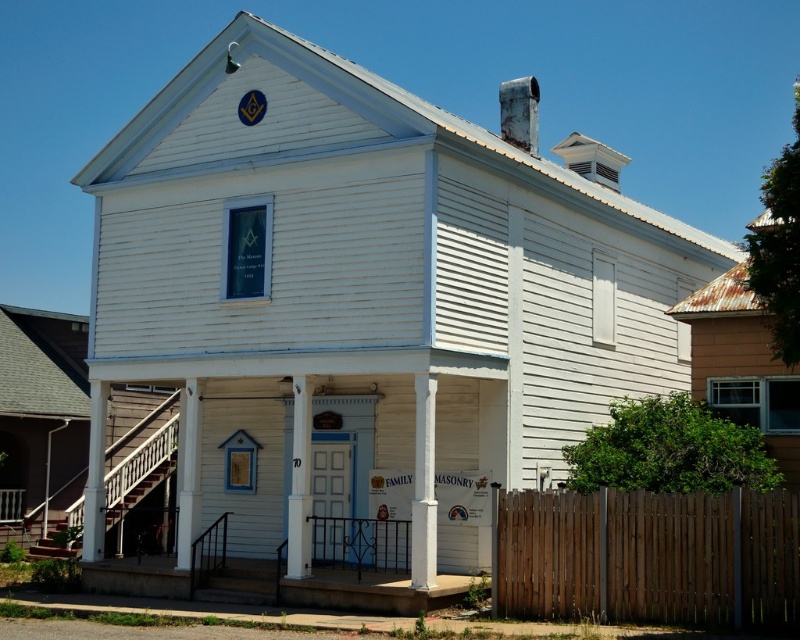
In the scene shown: Is brown wooden fence at lower right wider than white wood pillar at center?

Yes, brown wooden fence at lower right is wider than white wood pillar at center.

Who is taller, brown wooden fence at lower right or white wood pillar at center?

white wood pillar at center

Image resolution: width=800 pixels, height=640 pixels. What are the coordinates of `brown wooden fence at lower right` in the screenshot? It's located at (650, 557).

Which is below, white wood pillar at center or white painted wood post at center?

Positioned lower is white painted wood post at center.

Between white wood pillar at center and white painted wood post at center, which one appears on the right side from the viewer's perspective?

white wood pillar at center

Who is more forward, (416, 556) or (296, 532)?

Point (416, 556) is more forward.

Find the location of a particular element. The image size is (800, 640). white wood pillar at center is located at coordinates [x=424, y=484].

Between brown wooden fence at lower right and white painted wood post at center, which one is positioned lower?

brown wooden fence at lower right is below.

Is brown wooden fence at lower right positioned before white painted wood post at center?

Yes, brown wooden fence at lower right is in front of white painted wood post at center.

Is point (690, 502) more distant than point (292, 508)?

No, it is in front of (292, 508).

This screenshot has height=640, width=800. What are the coordinates of `brown wooden fence at lower right` in the screenshot? It's located at (650, 557).